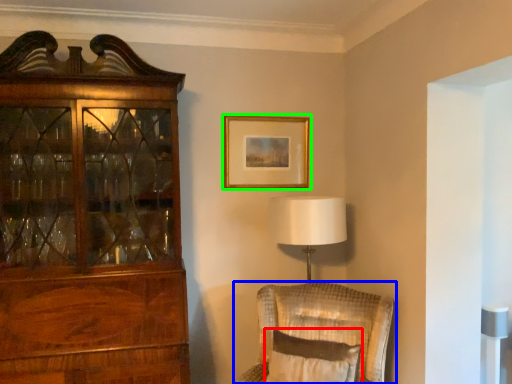
Question: Which is farther away from pillow (highlighted by a red box)? chair (highlighted by a blue box) or picture frame (highlighted by a green box)?

Choices:
 (A) chair
 (B) picture frame

Answer: (B)